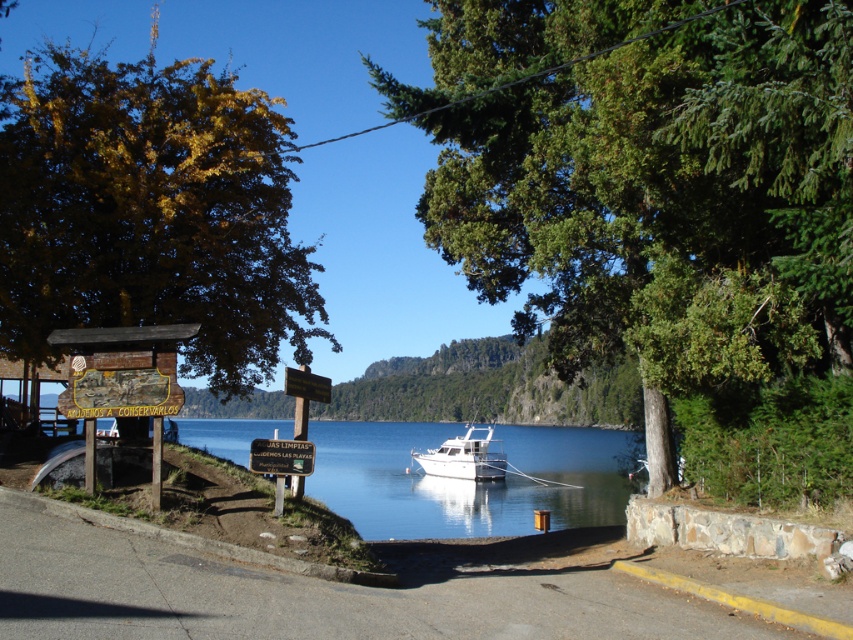
Question: Can you confirm if green leafy tree at center is positioned to the left of white glossy boat at center?

Choices:
 (A) no
 (B) yes

Answer: (A)

Question: Which point appears closest to the camera in this image?

Choices:
 (A) (624, 474)
 (B) (166, 108)

Answer: (B)

Question: Considering the relative positions of clear water at center and white glossy boat at center in the image provided, where is clear water at center located with respect to white glossy boat at center?

Choices:
 (A) left
 (B) right

Answer: (A)

Question: In this image, where is clear water at center located relative to white glossy boat at center?

Choices:
 (A) below
 (B) above

Answer: (B)

Question: Among these points, which one is farthest from the camera?

Choices:
 (A) (6, 164)
 (B) (448, 468)
 (C) (573, 300)
 (D) (422, 477)

Answer: (D)

Question: Among these points, which one is farthest from the camera?

Choices:
 (A) (601, 518)
 (B) (94, 77)
 (C) (723, 86)

Answer: (A)